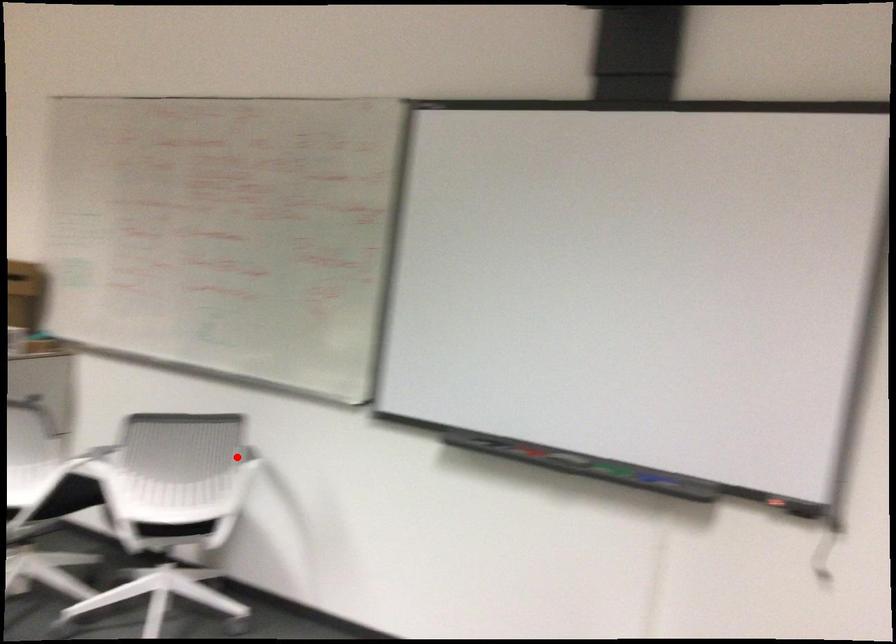
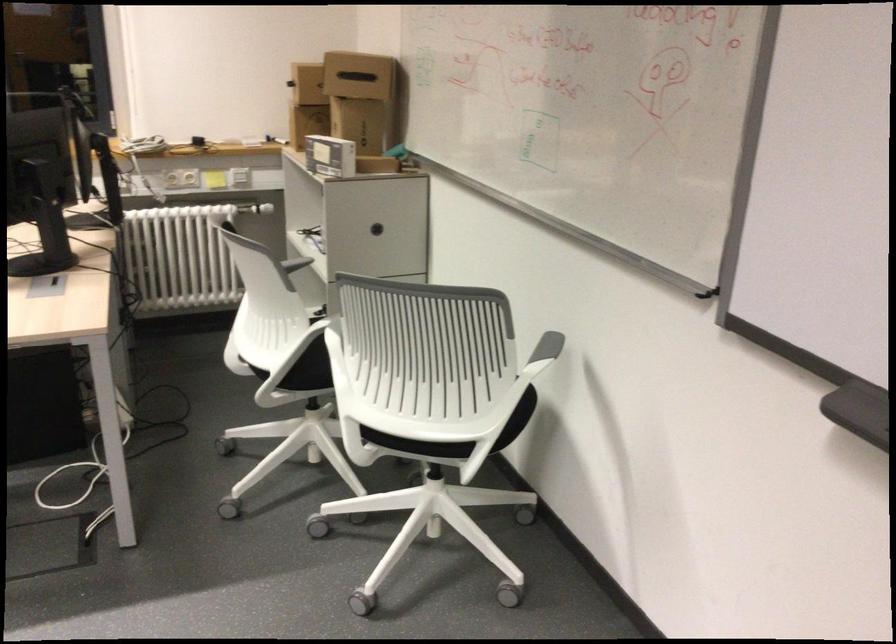
Question: I am providing you with two images of the same scene from different viewpoints. In image1, a red point is highlighted. Considering the same 3D point in image2, which of the following is correct?

Choices:
 (A) It is closer
 (B) It is farther

Answer: (A)